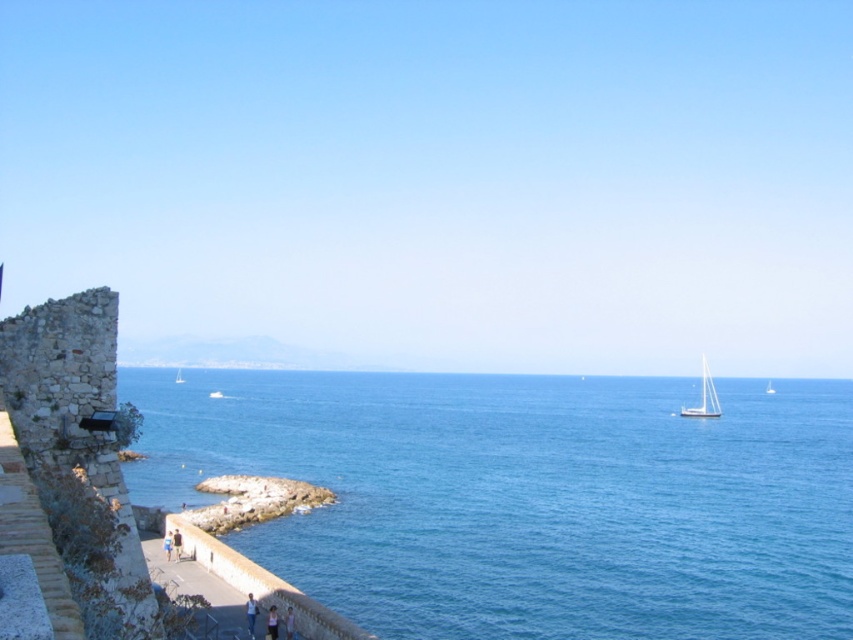
Consider the image. Can you confirm if light blue denim shorts at lower center is positioned to the right of white glossy sailboat at center?

Yes, light blue denim shorts at lower center is to the right of white glossy sailboat at center.

Which of these two, light blue denim shorts at lower center or white glossy sailboat at center, stands taller?

Standing taller between the two is light blue denim shorts at lower center.

Identify the location of light blue denim shorts at lower center. (251, 614).

Is light brown leather jacket at lower left bigger than blue fabric person at lower center?

No, light brown leather jacket at lower left is not bigger than blue fabric person at lower center.

Who is taller, light brown leather jacket at lower left or blue fabric person at lower center?

light brown leather jacket at lower left is taller.

Measure the distance between point (178, 532) and camera.

Point (178, 532) and camera are 47.39 meters apart.

Where is `light brown leather jacket at lower left`? The image size is (853, 640). light brown leather jacket at lower left is located at coordinates (177, 544).

Which is below, white glossy sailboat at right or white glossy sailboat at center?

white glossy sailboat at center is below.

Identify the location of white glossy sailboat at right. The width and height of the screenshot is (853, 640). (704, 397).

The width and height of the screenshot is (853, 640). I want to click on white glossy sailboat at right, so pos(704,397).

Where is `white glossy sailboat at right`? This screenshot has height=640, width=853. white glossy sailboat at right is located at coordinates (704, 397).